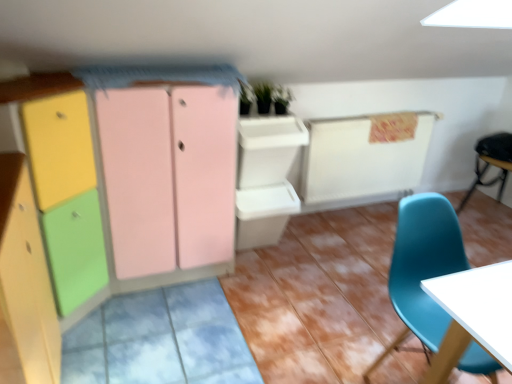
Question: From a real-world perspective, relative to matte wood cabinet at left, the second cabinetry when ordered from back to front, is matte wood cabinet at left, marked as the third cabinetry in a back-to-front arrangement, vertically above or below?

Choices:
 (A) below
 (B) above

Answer: (A)

Question: Looking at their shapes, would you say matte wood cabinet at left, marked as the third cabinetry in a back-to-front arrangement, is wider or thinner than matte wood cabinet at left, the second cabinetry when ordered from back to front?

Choices:
 (A) thin
 (B) wide

Answer: (A)

Question: Estimate the real-world distances between objects in this image. Which object is farther from the matte plastic dresser at center?

Choices:
 (A) teal plastic chair at lower right, which ranks as the 2th chair in right-to-left order
 (B) green matte plant at upper center
 (C) matte wood cabinet at left, marked as the third cabinetry in a back-to-front arrangement
 (D) matte wood cabinet at left, placed as the second cabinetry when sorted from front to back
 (E) matte pink cabinet at center, which is the third cabinetry from front to back

Answer: (A)

Question: Estimate the real-world distances between objects in this image. Which object is farther from the matte plastic dresser at center?

Choices:
 (A) black leather chair at right, positioned as the 1th chair in back-to-front order
 (B) matte wood cabinet at left, the first cabinetry in the front-to-back sequence
 (C) matte wood cabinet at left, placed as the second cabinetry when sorted from front to back
 (D) matte pink cabinet at center, which is the third cabinetry from front to back
 (E) teal plastic chair at lower right, the first chair from the front

Answer: (A)